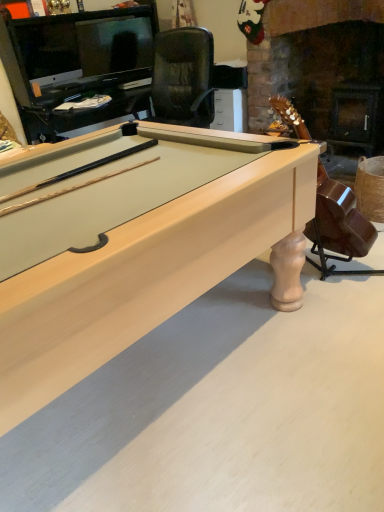
Where is `free area below matte brown guitar at center-right (from a real-world perspective)`? free area below matte brown guitar at center-right (from a real-world perspective) is located at coordinates (337, 279).